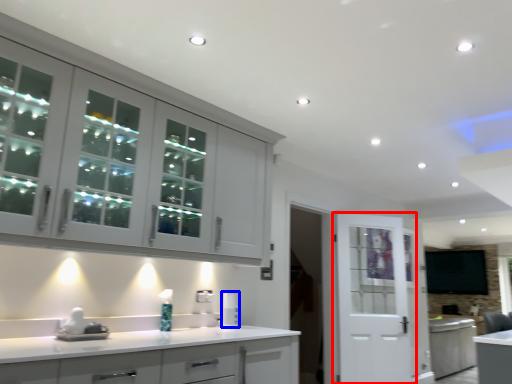
Question: Which of the following is the farthest to the observer, door (highlighted by a red box) or appliance (highlighted by a blue box)?

Choices:
 (A) door
 (B) appliance

Answer: (A)